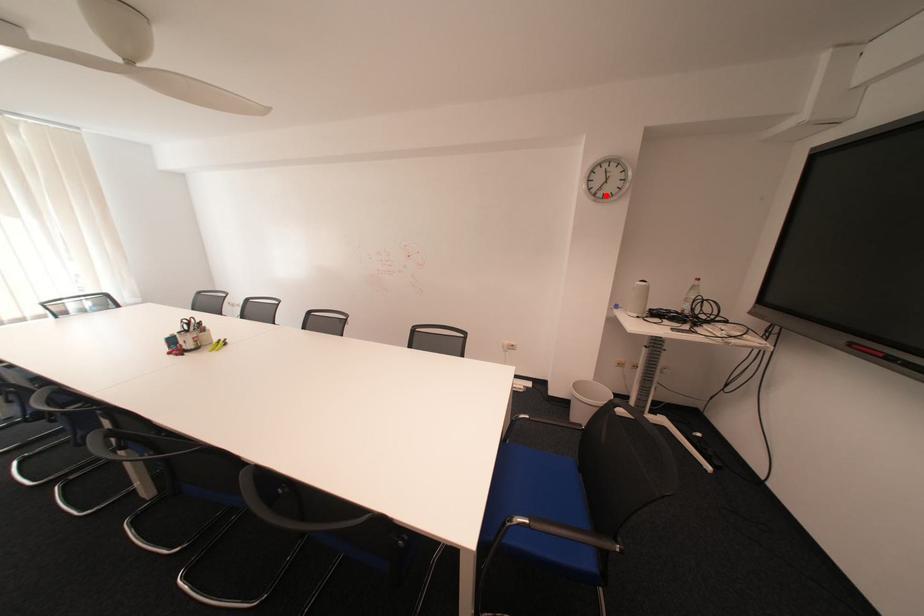
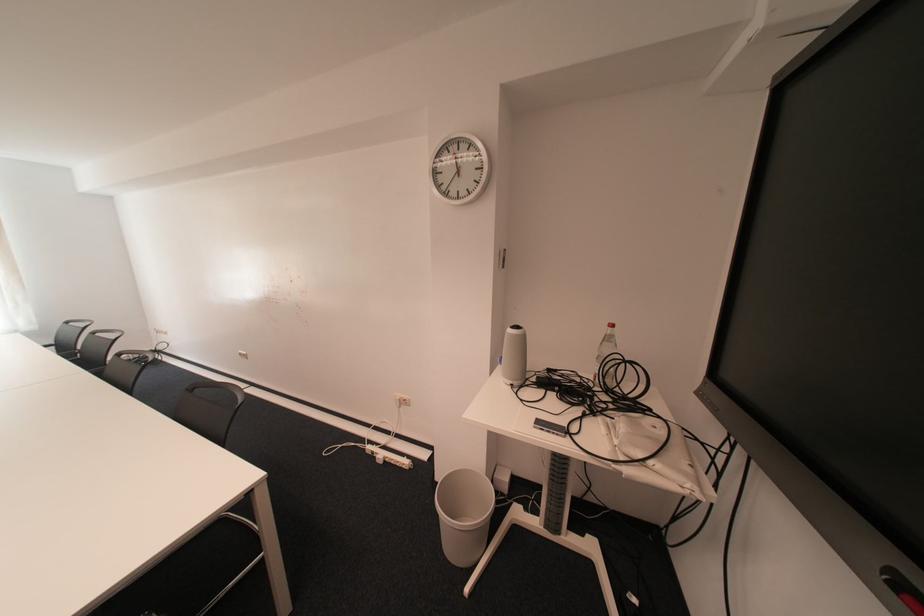
The point at the highlighted location is marked in the first image. Where is the corresponding point in the second image?

(457, 195)